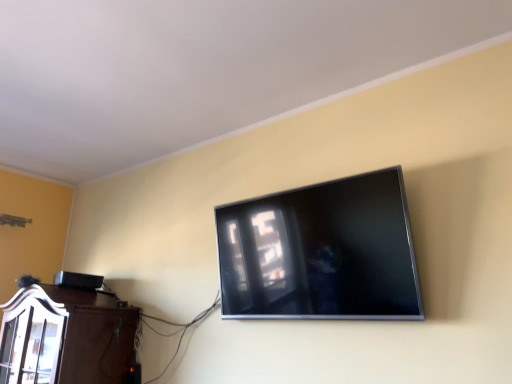
This screenshot has height=384, width=512. What do you see at coordinates (321, 252) in the screenshot? I see `satin black tv at upper center` at bounding box center [321, 252].

In order to click on satin black tv at upper center in this screenshot , I will do `click(321, 252)`.

In order to click on brown wood cabinet at lower left in this screenshot , I will do `click(66, 337)`.

Describe the element at coordinates (66, 337) in the screenshot. I see `brown wood cabinet at lower left` at that location.

Locate an element on the screen. satin black tv at upper center is located at coordinates (321, 252).

Between satin black tv at upper center and brown wood cabinet at lower left, which one appears on the right side from the viewer's perspective?

From the viewer's perspective, satin black tv at upper center appears more on the right side.

Which is in front, satin black tv at upper center or brown wood cabinet at lower left?

satin black tv at upper center is closer to the camera.

Is point (270, 290) positioned behind point (25, 312)?

No.

From the image's perspective, is satin black tv at upper center above or below brown wood cabinet at lower left?

satin black tv at upper center is situated higher than brown wood cabinet at lower left in the image.

From a real-world perspective, is satin black tv at upper center positioned above or below brown wood cabinet at lower left?

In terms of real-world spatial position, satin black tv at upper center is above brown wood cabinet at lower left.

Between satin black tv at upper center and brown wood cabinet at lower left, which one has larger width?

With larger width is brown wood cabinet at lower left.

From the picture: Is satin black tv at upper center taller than brown wood cabinet at lower left?

Yes, satin black tv at upper center is taller than brown wood cabinet at lower left.

Is satin black tv at upper center smaller than brown wood cabinet at lower left?

Correct, satin black tv at upper center occupies less space than brown wood cabinet at lower left.

Would you say brown wood cabinet at lower left is part of satin black tv at upper center's contents?

No, brown wood cabinet at lower left is not a part of satin black tv at upper center.

Is satin black tv at upper center not near brown wood cabinet at lower left?

Yes, satin black tv at upper center and brown wood cabinet at lower left are located far from each other.

Is satin black tv at upper center oriented away from brown wood cabinet at lower left?

No, satin black tv at upper center's orientation is not away from brown wood cabinet at lower left.

How many degrees apart are the facing directions of satin black tv at upper center and brown wood cabinet at lower left?

They differ by 2.16 degrees in their facing directions.

Measure the distance from satin black tv at upper center to brown wood cabinet at lower left.

They are 1.08 meters apart.

Find the location of a particular element. This screenshot has height=384, width=512. furniture below the satin black tv at upper center (from a real-world perspective) is located at coordinates (66, 337).

Considering the relative positions of brown wood cabinet at lower left and satin black tv at upper center in the image provided, is brown wood cabinet at lower left to the left or to the right of satin black tv at upper center?

Clearly, brown wood cabinet at lower left is on the left of satin black tv at upper center in the image.

Is brown wood cabinet at lower left behind satin black tv at upper center?

Yes, it is behind satin black tv at upper center.

Does point (109, 349) lie in front of point (333, 265)?

No.

From the image's perspective, is brown wood cabinet at lower left beneath satin black tv at upper center?

Yes, from the image's perspective, brown wood cabinet at lower left is beneath satin black tv at upper center.

From a real-world perspective, who is located higher, brown wood cabinet at lower left or satin black tv at upper center?

satin black tv at upper center, from a real-world perspective.

Is brown wood cabinet at lower left thinner than satin black tv at upper center?

No, brown wood cabinet at lower left is not thinner than satin black tv at upper center.

Considering the sizes of brown wood cabinet at lower left and satin black tv at upper center in the image, is brown wood cabinet at lower left taller or shorter than satin black tv at upper center?

brown wood cabinet at lower left is shorter than satin black tv at upper center.

Considering the relative sizes of brown wood cabinet at lower left and satin black tv at upper center in the image provided, is brown wood cabinet at lower left bigger than satin black tv at upper center?

Indeed, brown wood cabinet at lower left has a larger size compared to satin black tv at upper center.

Would you say brown wood cabinet at lower left is outside satin black tv at upper center?

Yes.

Is brown wood cabinet at lower left in contact with satin black tv at upper center?

They are not placed beside each other.

Could you tell me if brown wood cabinet at lower left is facing satin black tv at upper center?

No, brown wood cabinet at lower left does not turn towards satin black tv at upper center.

I want to click on television above the brown wood cabinet at lower left (from the image's perspective), so click(321, 252).

Find the location of a particular element. television in front of the brown wood cabinet at lower left is located at coordinates (321, 252).

Image resolution: width=512 pixels, height=384 pixels. Find the location of `television located on the right of brown wood cabinet at lower left`. television located on the right of brown wood cabinet at lower left is located at coordinates [321, 252].